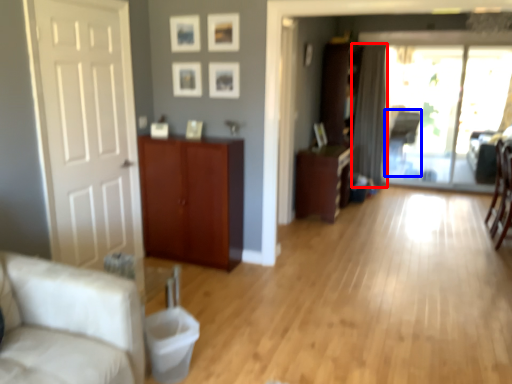
Question: Which point is closer to the camera, curtain (highlighted by a red box) or armchair (highlighted by a blue box)?

Choices:
 (A) curtain
 (B) armchair

Answer: (A)